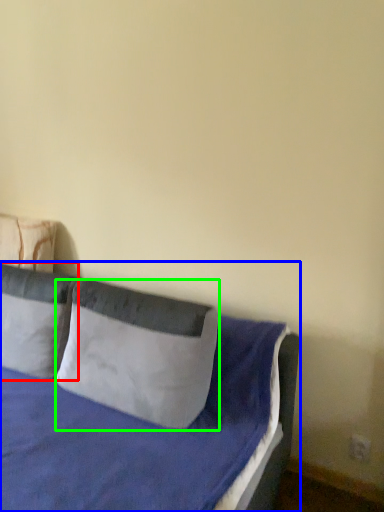
Question: Based on their relative distances, which object is nearer to pillow (highlighted by a red box)? Choose from bed (highlighted by a blue box) and pillow (highlighted by a green box).

Choices:
 (A) bed
 (B) pillow

Answer: (A)